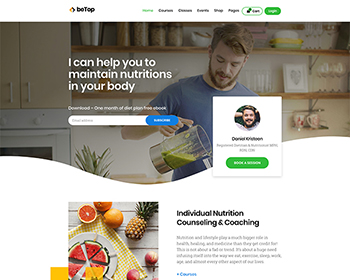
Where is `jug`? jug is located at coordinates (192, 137).